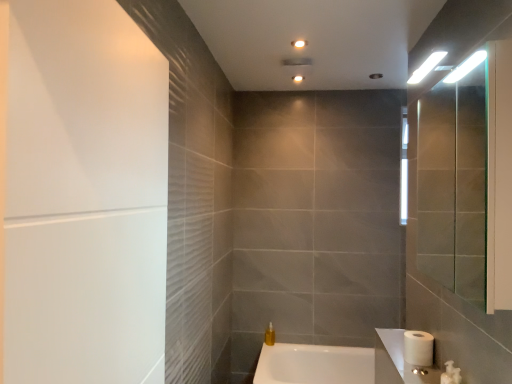
What do you see at coordinates (297, 79) in the screenshot?
I see `matte white ceiling light at upper center` at bounding box center [297, 79].

What is the approximate height of white matte screen door at left?

white matte screen door at left is 34.87 inches in height.

Where is `white glossy sink at lower right`? The width and height of the screenshot is (512, 384). white glossy sink at lower right is located at coordinates (398, 361).

Considering their positions, is translucent yellow liquid at lower center located in front of or behind white matte screen door at left?

translucent yellow liquid at lower center is positioned farther from the viewer than white matte screen door at left.

Does translucent yellow liquid at lower center appear on the right side of white matte screen door at left?

Yes.

How distant is translucent yellow liquid at lower center from white matte screen door at left?

2.46 meters.

In terms of height, does translucent yellow liquid at lower center look taller or shorter compared to white matte screen door at left?

Clearly, translucent yellow liquid at lower center is shorter compared to white matte screen door at left.

Considering the sizes of white glossy toilet at lower right and clear glass mirror at right in the image, is white glossy toilet at lower right taller or shorter than clear glass mirror at right?

Considering their sizes, white glossy toilet at lower right has less height than clear glass mirror at right.

Considering their positions, is white glossy toilet at lower right located in front of or behind clear glass mirror at right?

white glossy toilet at lower right is positioned farther from the viewer than clear glass mirror at right.

Is white glossy toilet at lower right thinner than clear glass mirror at right?

Indeed, white glossy toilet at lower right has a lesser width compared to clear glass mirror at right.

Is white glossy toilet at lower right not within clear glass mirror at right?

That's correct, white glossy toilet at lower right is outside of clear glass mirror at right.

Find the location of a particular element. toiletry below the matte white ceiling light at upper center (from the image's perspective) is located at coordinates click(x=270, y=335).

Considering the sizes of translucent yellow liquid at lower center and matte white ceiling light at upper center in the image, is translucent yellow liquid at lower center taller or shorter than matte white ceiling light at upper center?

In the image, translucent yellow liquid at lower center appears to be taller than matte white ceiling light at upper center.

Considering the positions of objects translucent yellow liquid at lower center and matte white ceiling light at upper center in the image provided, who is more to the left, translucent yellow liquid at lower center or matte white ceiling light at upper center?

From the viewer's perspective, translucent yellow liquid at lower center appears more on the left side.

Is clear glass mirror at right beside white glossy bathtub at lower center?

There is a gap between clear glass mirror at right and white glossy bathtub at lower center.

Considering the sizes of clear glass mirror at right and white glossy bathtub at lower center in the image, is clear glass mirror at right wider or thinner than white glossy bathtub at lower center?

Clearly, clear glass mirror at right has less width compared to white glossy bathtub at lower center.

Is white glossy bathtub at lower center completely or partially inside clear glass mirror at right?

That's incorrect, white glossy bathtub at lower center is not inside clear glass mirror at right.

Which is more to the right, white glossy bathtub at lower center or white glossy toilet at lower right?

white glossy toilet at lower right.

From a real-world perspective, is white glossy bathtub at lower center below white glossy toilet at lower right?

Indeed, from a real-world perspective, white glossy bathtub at lower center is positioned beneath white glossy toilet at lower right.

Consider the image. Between white glossy bathtub at lower center and white glossy toilet at lower right, which one is positioned behind?

white glossy bathtub at lower center.

How different are the orientations of white glossy bathtub at lower center and white glossy toilet at lower right in degrees?

The angle between the facing direction of white glossy bathtub at lower center and the facing direction of white glossy toilet at lower right is 6.07 degrees.

From a real-world perspective, which is physically above, white glossy toilet at lower right or white matte screen door at left?

From a 3D spatial view, white matte screen door at left is above.

In the scene shown: Between white glossy toilet at lower right and white matte screen door at left, which one has smaller size?

white glossy toilet at lower right.

Can you confirm if white glossy toilet at lower right is shorter than white matte screen door at left?

Yes, white glossy toilet at lower right is shorter than white matte screen door at left.

Is point (444, 376) positioned before point (37, 65)?

No, (444, 376) is further to viewer.

From a real-world perspective, which is physically above, matte white ceiling light at upper center or clear glass mirror at right?

matte white ceiling light at upper center, from a real-world perspective.

Is point (294, 76) positioned behind point (463, 194)?

No, (294, 76) is in front of (463, 194).

Which object is closer to the camera, matte white ceiling light at upper center or clear glass mirror at right?

clear glass mirror at right is more forward.

Where is `mirror that is below the matte white ceiling light at upper center (from the image's perspective)`? The image size is (512, 384). mirror that is below the matte white ceiling light at upper center (from the image's perspective) is located at coordinates (453, 184).

Identify the location of screen door above the translucent yellow liquid at lower center (from the image's perspective). This screenshot has height=384, width=512. (84, 196).

You are a GUI agent. You are given a task and a screenshot of the screen. Output one action in this format:
    pyautogui.click(x=<x>, y=<y>)
    Task: Click on the plumbing fixture below the clear glass mirror at right (from the image's perspective)
    Image resolution: width=512 pixels, height=384 pixels.
    Given the screenshot: What is the action you would take?
    pyautogui.click(x=451, y=374)

Based on their spatial positions, is white glossy toilet at lower right or white matte screen door at left further from matte white ceiling light at upper center?

white matte screen door at left is further to matte white ceiling light at upper center.

Which object lies nearer to the anchor point white glossy toilet at lower right, white matte screen door at left or white glossy sink at lower right?

white glossy sink at lower right is positioned closer to the anchor white glossy toilet at lower right.

Looking at the image, which one is located further to white matte toilet paper at lower right, white matte screen door at left or clear glass mirror at right?

The object further to white matte toilet paper at lower right is white matte screen door at left.

Looking at the image, which one is located closer to white glossy sink at lower right, translucent yellow liquid at lower center or white glossy toilet at lower right?

white glossy toilet at lower right lies closer to white glossy sink at lower right than the other object.

Estimate the real-world distances between objects in this image. Which object is further from matte white ceiling light at upper center, translucent yellow liquid at lower center or white matte toilet paper at lower right?

Among the two, translucent yellow liquid at lower center is located further to matte white ceiling light at upper center.

Based on their spatial positions, is white matte toilet paper at lower right or translucent yellow liquid at lower center closer to white matte screen door at left?

Among the two, white matte toilet paper at lower right is located nearer to white matte screen door at left.

Considering their positions, is white matte screen door at left positioned further to white glossy bathtub at lower center than matte white ceiling light at upper center?

white matte screen door at left is positioned further to the anchor white glossy bathtub at lower center.

Considering their positions, is matte white ceiling light at upper center positioned further to white matte screen door at left than white glossy sink at lower right?

matte white ceiling light at upper center is positioned further to the anchor white matte screen door at left.

The height and width of the screenshot is (384, 512). What are the coordinates of `mirror located between white matte screen door at left and white glossy toilet at lower right in the left-right direction` in the screenshot? It's located at (453, 184).

Find the location of a particular element. bathtub between white matte toilet paper at lower right and translucent yellow liquid at lower center along the z-axis is located at coordinates (314, 364).

This screenshot has height=384, width=512. Find the location of `bathtub between white matte screen door at left and matte white ceiling light at upper center from front to back`. bathtub between white matte screen door at left and matte white ceiling light at upper center from front to back is located at coordinates (314, 364).

What are the coordinates of `plumbing fixture between white matte screen door at left and white glossy bathtub at lower center from front to back` in the screenshot? It's located at (451, 374).